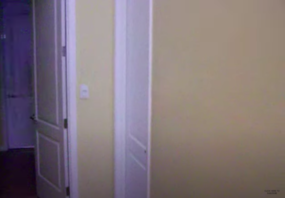
I want to click on trim on doors, so click(x=119, y=83), click(x=70, y=91).